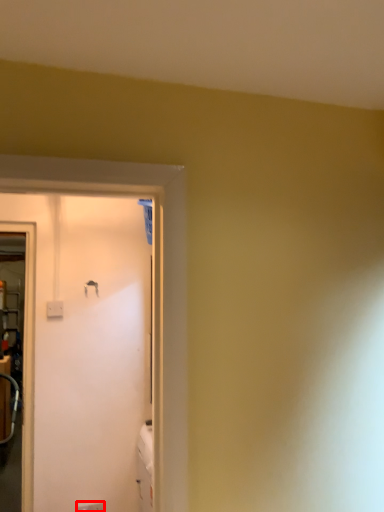
Question: From the image's perspective, where is electric outlet (annotated by the red box) located in relation to door handle in the image?

Choices:
 (A) above
 (B) below

Answer: (B)